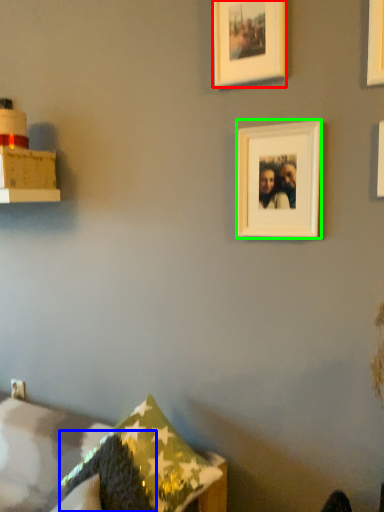
Question: Which object is the farthest from picture frame (highlighted by a red box)? Choose among these: pillow (highlighted by a blue box) or picture frame (highlighted by a green box).

Choices:
 (A) pillow
 (B) picture frame

Answer: (A)